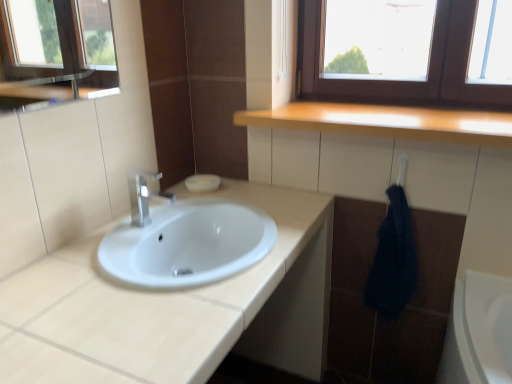
You are a GUI agent. You are given a task and a screenshot of the screen. Output one action in this format:
    pyautogui.click(x=<x>, y=<y>)
    Task: Click on the free spot behind satin nickel faucet at center
    The height and width of the screenshot is (384, 512).
    Given the screenshot: What is the action you would take?
    pyautogui.click(x=185, y=219)